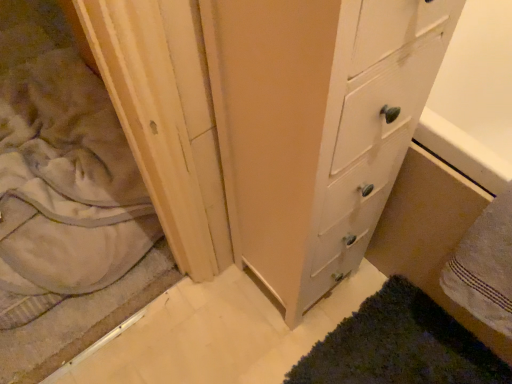
Where is `vacant space situated on the left part of dark green shaggy bath mat at lower right`? This screenshot has width=512, height=384. vacant space situated on the left part of dark green shaggy bath mat at lower right is located at coordinates (245, 332).